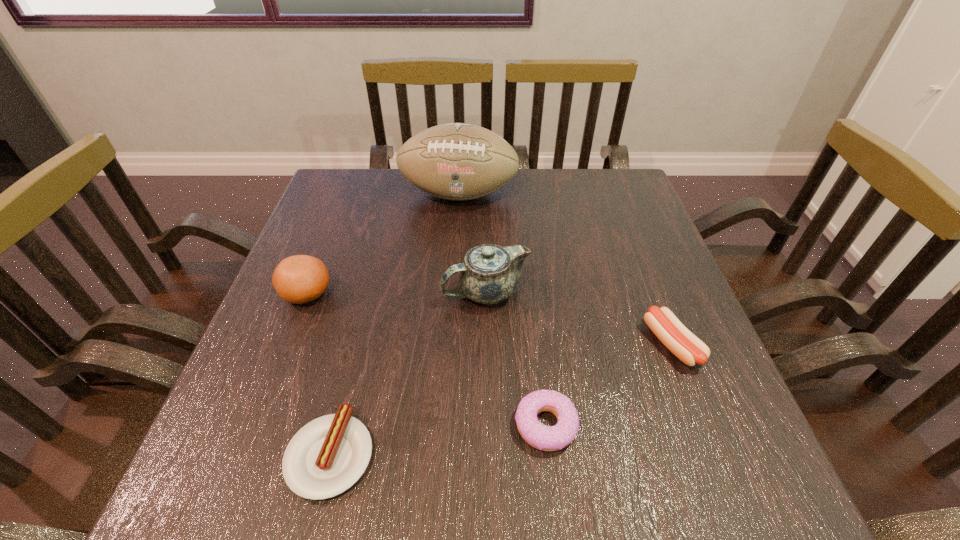
At what (x,y) coordinates should I click in order to perform the action: click on sausage present at the near edge. Please return your answer as a coordinate pair (x, y). The height and width of the screenshot is (540, 960). Looking at the image, I should click on (327, 456).

Locate an element on the screen. clementine that is at the left edge is located at coordinates (x=298, y=279).

This screenshot has height=540, width=960. Find the location of `sausage at the left edge`. sausage at the left edge is located at coordinates (327, 456).

At what (x,y) coordinates should I click in order to perform the action: click on object positioned at the right edge. Please return your answer as a coordinate pair (x, y). The width and height of the screenshot is (960, 540). Looking at the image, I should click on (688, 348).

At what (x,y) coordinates should I click in order to perform the action: click on object situated at the near left corner. Please return your answer as a coordinate pair (x, y). Image resolution: width=960 pixels, height=540 pixels. Looking at the image, I should click on (327, 456).

At what (x,y) coordinates should I click in order to perform the action: click on free point at the far edge. Please return your answer as a coordinate pair (x, y). The width and height of the screenshot is (960, 540). Looking at the image, I should click on (552, 171).

This screenshot has width=960, height=540. In the image, there is a desktop. Find the location of `free space at the near edge`. free space at the near edge is located at coordinates (502, 458).

At what (x,y) coordinates should I click in order to perform the action: click on vacant space at the left edge of the desktop. Please return your answer as a coordinate pair (x, y). Image resolution: width=960 pixels, height=540 pixels. Looking at the image, I should click on (358, 254).

Where is `blank area at the right edge`? blank area at the right edge is located at coordinates (612, 279).

Locate an element on the screen. This screenshot has height=540, width=960. blank space at the far left corner is located at coordinates (365, 184).